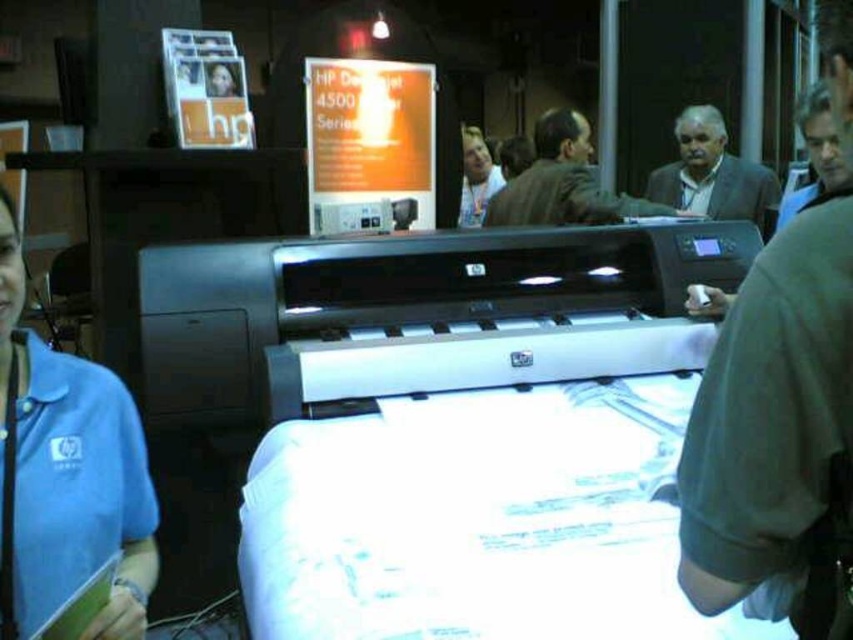
Consider the image. Is dark gray shirt at center shorter than dark brown leather jacket at center?

In fact, dark gray shirt at center may be taller than dark brown leather jacket at center.

Is point (805, 268) behind point (546, 166)?

No, (805, 268) is in front of (546, 166).

The height and width of the screenshot is (640, 853). Identify the location of dark gray shirt at center. (776, 433).

Is gray suit jacket at upper right closer to camera compared to matte black shirt at upper center?

Yes.

Is point (767, 176) positioned behind point (486, 179)?

No, (767, 176) is closer to viewer.

The height and width of the screenshot is (640, 853). I want to click on gray suit jacket at upper right, so click(x=712, y=173).

Can you confirm if satin silver printer at center is positioned below blue fabric shirt at left?

No, satin silver printer at center is not below blue fabric shirt at left.

Is point (520, 232) behind point (53, 566)?

That is True.

Find the location of `satin silver printer at center`. satin silver printer at center is located at coordinates (419, 312).